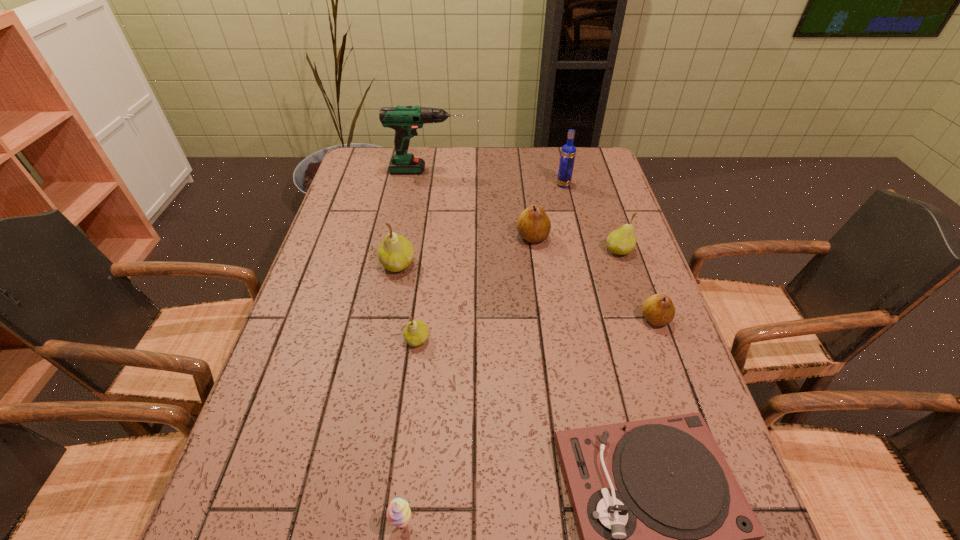
You are a GUI agent. You are given a task and a screenshot of the screen. Output one action in this format:
    pyautogui.click(x=<x>, y=<y>)
    Task: Click on the right brown pear
    The image size is (960, 540).
    Given the screenshot: What is the action you would take?
    pyautogui.click(x=658, y=309)

Identify the location of the nearest green pear. (416, 332).

Find the location of a particular element. The height and width of the screenshot is (540, 960). the smallest green pear is located at coordinates (416, 332).

You are a GUI agent. You are given a task and a screenshot of the screen. Output one action in this format:
    pyautogui.click(x=<x>, y=<y>)
    Task: Click on the sherbert
    The width and height of the screenshot is (960, 540).
    Given the screenshot: What is the action you would take?
    pyautogui.click(x=398, y=513)

Where is `free space located on the handle side of the tallest object`? Image resolution: width=960 pixels, height=540 pixels. free space located on the handle side of the tallest object is located at coordinates (535, 171).

Identify the location of free location located 0.080m on the front of the eighth nearest object. (568, 202).

The image size is (960, 540). What are the coordinates of `free space located on the back of the biggest green pear` in the screenshot? It's located at (408, 212).

Locate an element on the screen. Image resolution: width=960 pixels, height=540 pixels. vacant space located on the right of the left brown pear is located at coordinates (631, 237).

The width and height of the screenshot is (960, 540). I want to click on vacant region located 0.110m on the back of the rightmost green pear, so click(609, 218).

You are a GUI agent. You are given a task and a screenshot of the screen. Output one action in this format:
    pyautogui.click(x=<x>, y=<y>)
    Task: Click on the vacant space located on the left of the right brown pear
    Image resolution: width=960 pixels, height=540 pixels.
    Given the screenshot: What is the action you would take?
    pos(595,319)